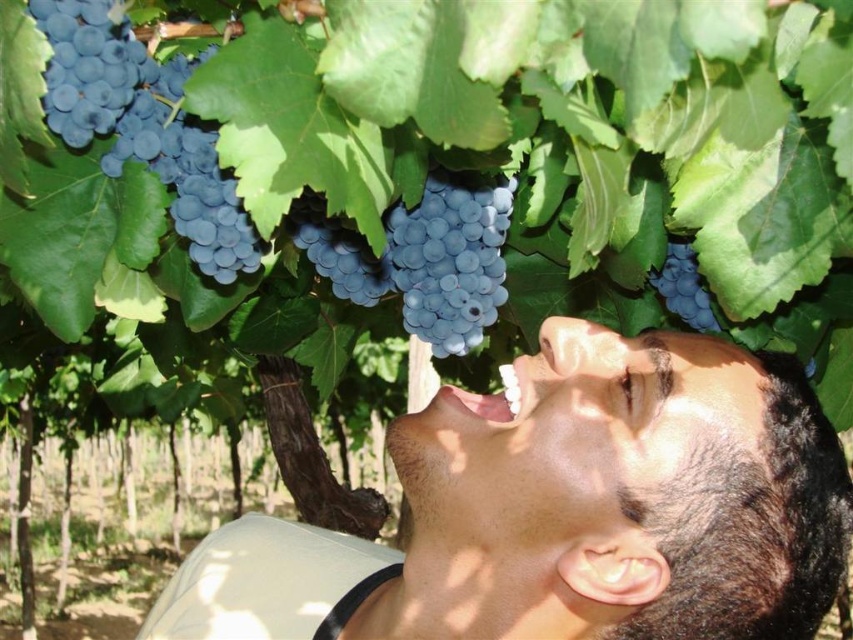
You are a farmer checking the grapevines. You notice the blue matte grapes at upper left and the matte dark blue grape at upper right. Which one is wider?

The blue matte grapes at upper left might be wider than the matte dark blue grape at upper right according to the description.

You are a painter standing in the vineyard and want to paint the blue matte grapes at upper left and the matte dark blue grape at upper right. Which grape cluster is taller?

The blue matte grapes at upper left is much taller than the matte dark blue grape at upper right according to the scene description.

You are a photographer aiming to capture a closeup of the blue matte grape at center and the matte dark blue grape at upper right. Which grape should you focus on first to ensure both are in sharp focus?

The blue matte grape at center is closer to the viewer than the matte dark blue grape at upper right, so you should focus on the blue matte grape at center first to ensure both are in sharp focus.